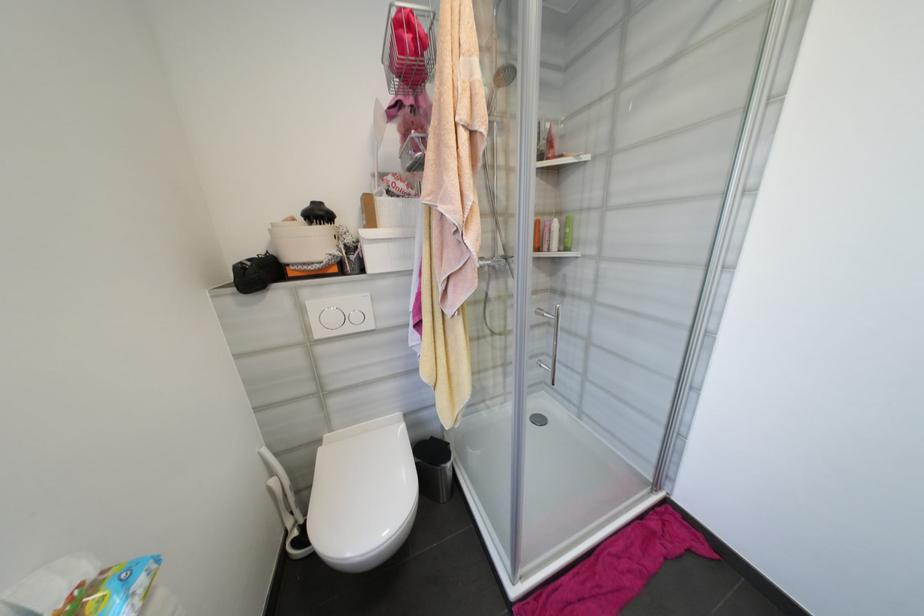
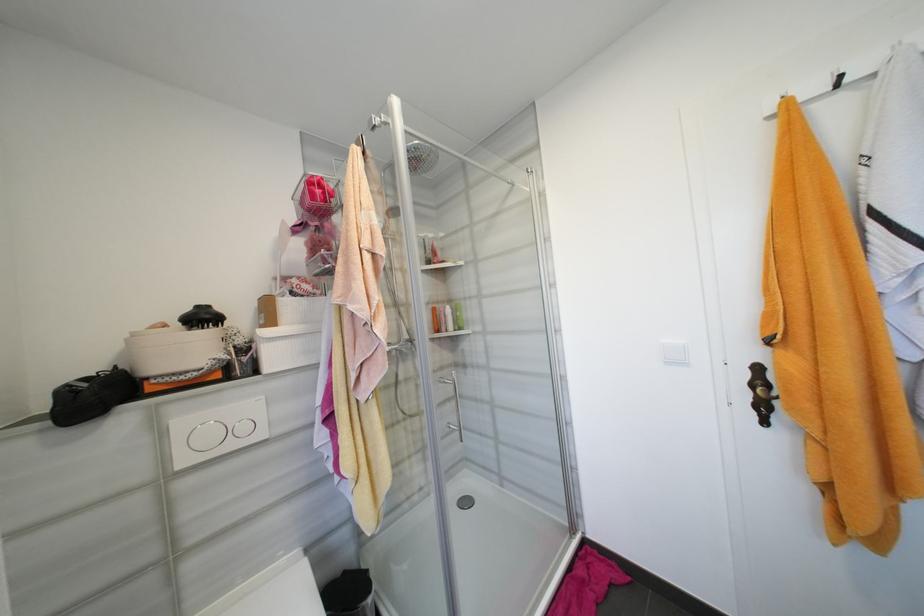
First-person continuous shooting, in which direction is the camera rotating?

The camera rotated toward right-up.